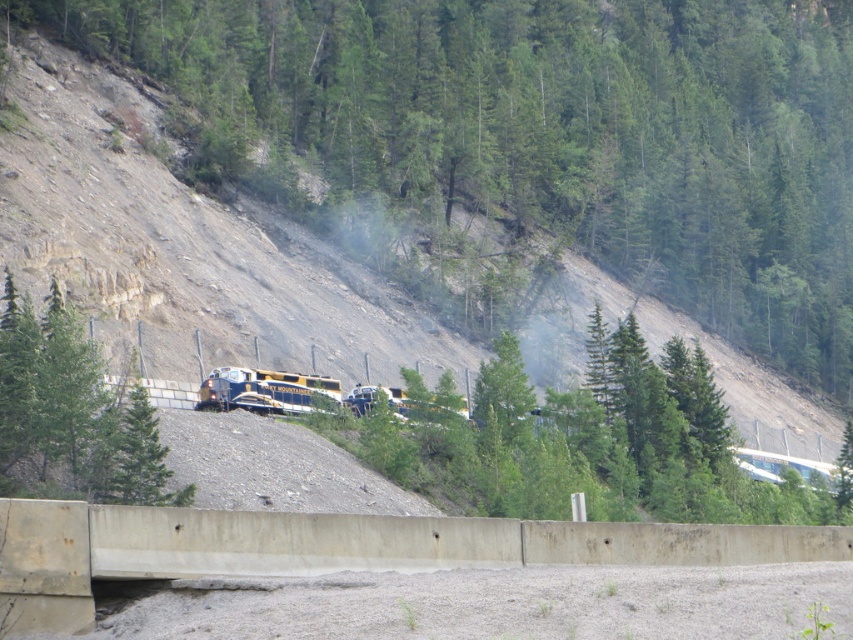
You are standing at the point marked as point [554,129]. What do you see directly in front of you?

The point [554,129] indicates a green leafy tree at center, so you would see the green leafy tree at center directly in front of you.

You are standing at the concrete barrier in the foreground of the railway scene. There are two points marked on the track ahead. Which point is closer to you, point (x=39, y=323) or point (x=225, y=385)?

Point (x=39, y=323) is closer to the viewer than point (x=225, y=385).